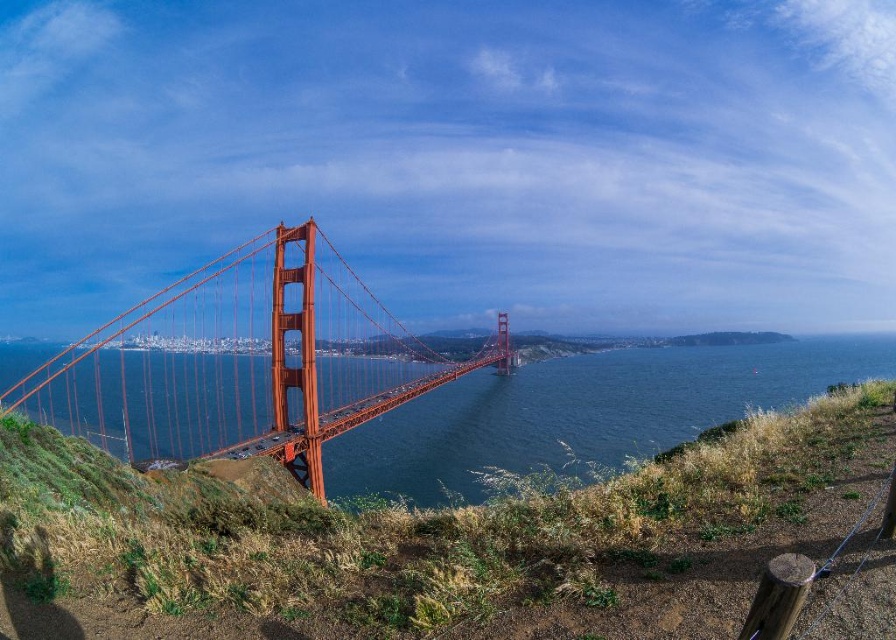
You are standing on the grassy hillside near the Golden Gate Bridge and see two points marked on the ground. The first point is at coordinates point (x=201, y=422) and the second point is at point (x=337, y=458). Which point is closer to you?

Point (x=201, y=422) is further to the camera than point (x=337, y=458), so the point closer to you is point (x=337, y=458).

You are a photographer planning to capture the Golden Gate Bridge. You have a camera with a limited field of view. Given the bright orange bridge at center and the transparent blue water at center, which object will appear narrower in your photo?

The bright orange bridge at center will appear narrower in the photo because it is thinner than the transparent blue water at center.